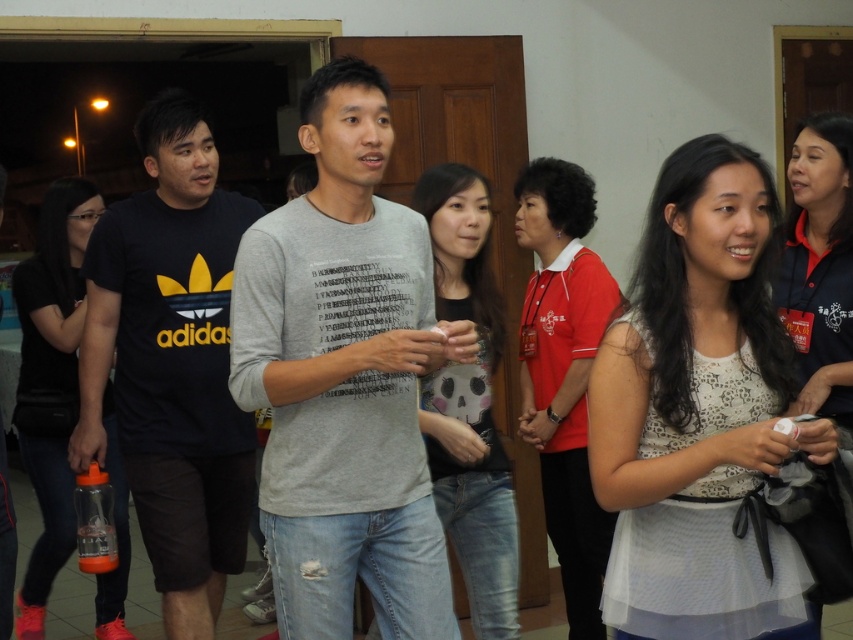
Question: Is gray cotton t-shirt at center wider than black matte t-shirt at left?

Choices:
 (A) no
 (B) yes

Answer: (A)

Question: Is gray cotton t-shirt at center smaller than black matte t-shirt at left?

Choices:
 (A) yes
 (B) no

Answer: (A)

Question: Which point is farther to the camera?

Choices:
 (A) (223, 232)
 (B) (344, 262)

Answer: (A)

Question: Which point is closer to the camera?

Choices:
 (A) (161, 266)
 (B) (358, 241)

Answer: (B)

Question: Where is gray cotton t-shirt at center located in relation to black matte t-shirt at left in the image?

Choices:
 (A) below
 (B) above

Answer: (B)